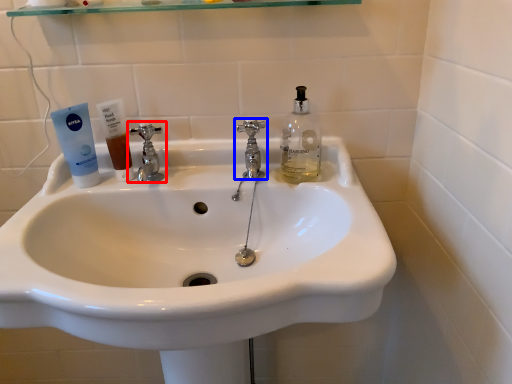
Question: Which point is closer to the camera, tap (highlighted by a red box) or tap (highlighted by a blue box)?

Choices:
 (A) tap
 (B) tap

Answer: (B)